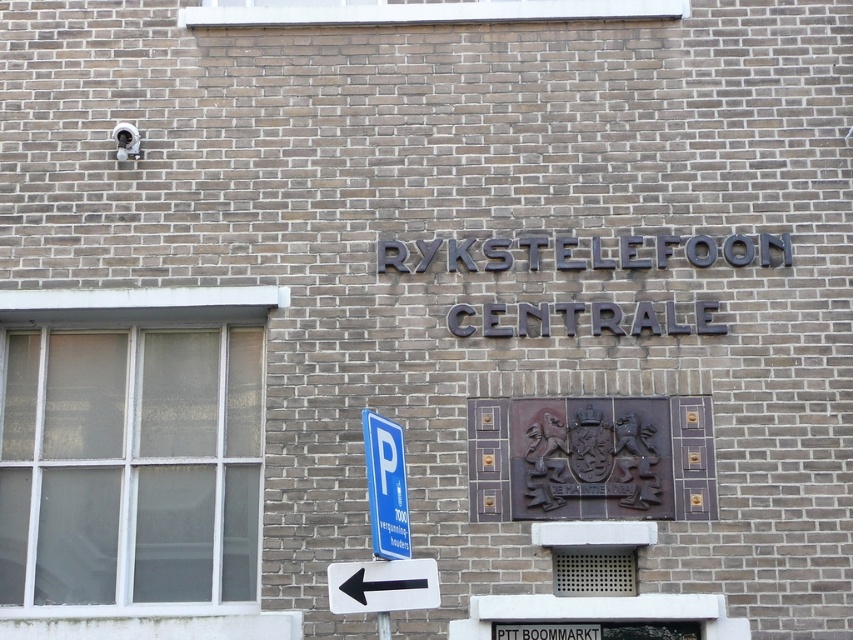
Between blue plastic parking sign at lower left and blue metallic parking sign at lower left, which one appears on the left side from the viewer's perspective?

From the viewer's perspective, blue plastic parking sign at lower left appears more on the left side.

What are the coordinates of `blue plastic parking sign at lower left` in the screenshot? It's located at 386,486.

Is point (383, 513) in front of point (544, 628)?

Yes, point (383, 513) is closer to viewer.

The width and height of the screenshot is (853, 640). I want to click on blue plastic parking sign at lower left, so click(386, 486).

Is blue metallic parking sign at lower left positioned behind black plastic arrow at lower left?

Yes, it is.

Is blue metallic parking sign at lower left to the right of black plastic arrow at lower left from the viewer's perspective?

Yes, blue metallic parking sign at lower left is to the right of black plastic arrow at lower left.

Which is behind, point (520, 624) or point (357, 596)?

The point (520, 624) is behind.

Locate an element on the screen. blue metallic parking sign at lower left is located at coordinates (546, 630).

Is blue plastic parking sign at lower left thinner than black plastic arrow at lower left?

Correct, blue plastic parking sign at lower left's width is less than black plastic arrow at lower left's.

Which is behind, point (398, 545) or point (367, 588)?

The point (398, 545) is more distant.

Locate an element on the screen. This screenshot has width=853, height=640. blue plastic parking sign at lower left is located at coordinates (386, 486).